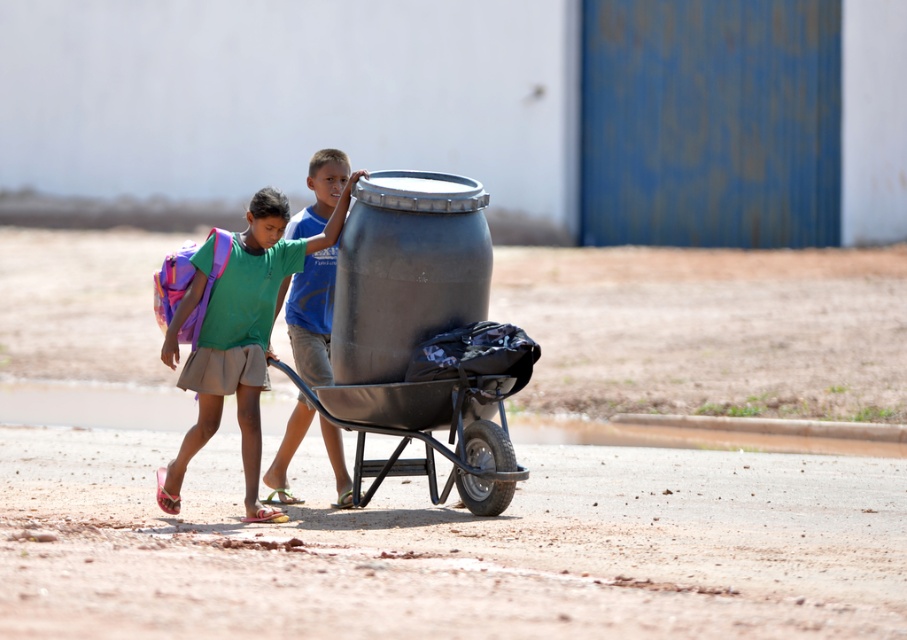
Question: Which object is closer to the camera taking this photo?

Choices:
 (A) green fabric backpack at left
 (B) brushed metal barrel at center
 (C) black metal wheelbarrow at center

Answer: (C)

Question: Which point is closer to the camera?

Choices:
 (A) (317, 401)
 (B) (258, 340)
 (C) (320, 228)

Answer: (A)

Question: Does green fabric backpack at left have a larger size compared to black metal wheelbarrow at center?

Choices:
 (A) yes
 (B) no

Answer: (A)

Question: Can you confirm if black metal wheelbarrow at center is thinner than brushed metal barrel at center?

Choices:
 (A) no
 (B) yes

Answer: (A)

Question: Can you confirm if green fabric backpack at left is positioned to the right of black metal wheelbarrow at center?

Choices:
 (A) yes
 (B) no

Answer: (B)

Question: Estimate the real-world distances between objects in this image. Which object is closer to the black metal wheelbarrow at center?

Choices:
 (A) brushed metal barrel at center
 (B) green fabric backpack at left

Answer: (A)